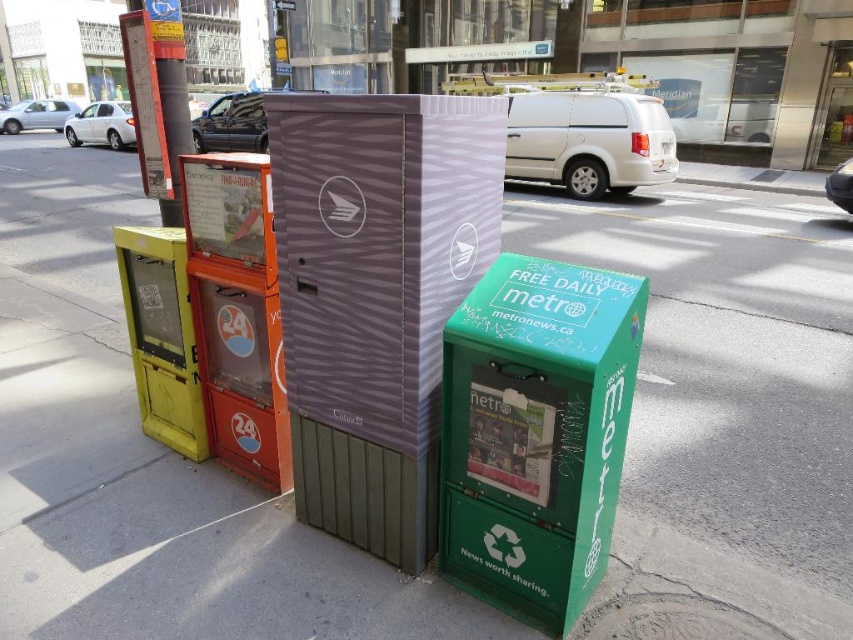
Consider the image. Is purple striped mailbox at center bigger than green matte newspaper box at lower right?

Indeed, purple striped mailbox at center has a larger size compared to green matte newspaper box at lower right.

Does purple striped mailbox at center appear over green matte newspaper box at lower right?

Indeed, purple striped mailbox at center is positioned over green matte newspaper box at lower right.

Does point (267, 122) come closer to viewer compared to point (585, 586)?

Yes, point (267, 122) is in front of point (585, 586).

At what (x,y) coordinates should I click in order to perform the action: click on purple striped mailbox at center. Please return your answer as a coordinate pair (x, y). This screenshot has height=640, width=853. Looking at the image, I should click on (379, 248).